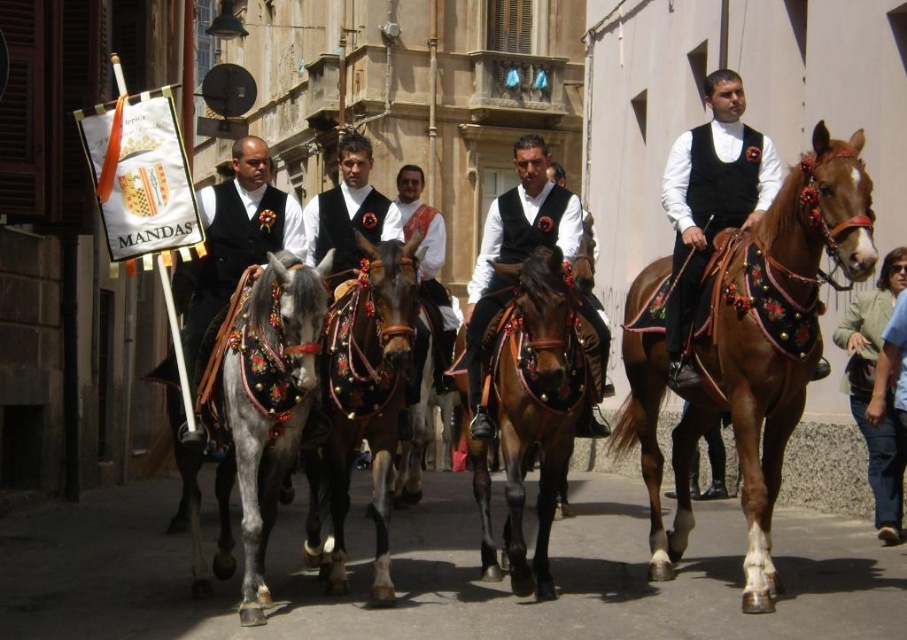
Question: Does brown leather horse at right appear on the right side of shiny black vest at center?

Choices:
 (A) yes
 (B) no

Answer: (A)

Question: Is brown leather horse at right thinner than matte black vest at left?

Choices:
 (A) no
 (B) yes

Answer: (A)

Question: Considering the real-world distances, which object is closest to the shiny black vest at center?

Choices:
 (A) gray glossy horse at left
 (B) brown leather horse at right

Answer: (B)

Question: Which object is the farthest from the gray glossy horse at left?

Choices:
 (A) green fabric jacket at lower right
 (B) shiny black vest at center

Answer: (A)

Question: Which is farther from the gray glossy horse at left?

Choices:
 (A) shiny brown horse at center
 (B) matte black vest at left
 (C) green fabric jacket at lower right

Answer: (C)

Question: Considering the relative positions of brown glossy horse at center and green fabric jacket at lower right in the image provided, where is brown glossy horse at center located with respect to green fabric jacket at lower right?

Choices:
 (A) right
 (B) left

Answer: (B)